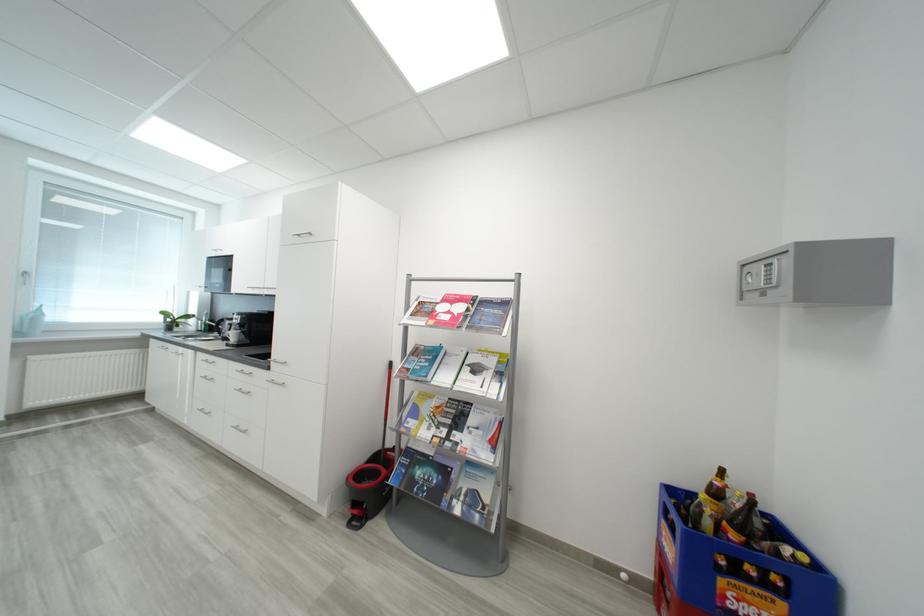
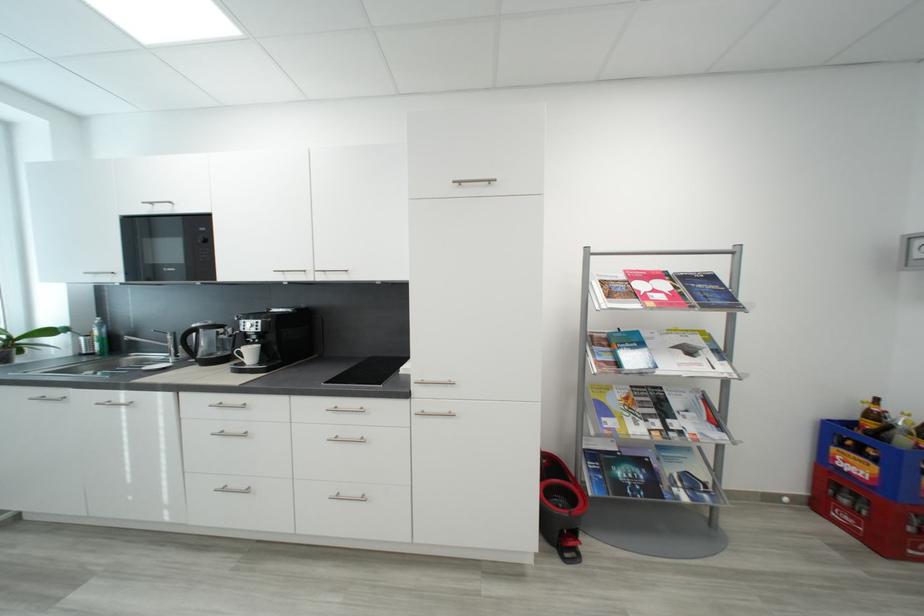
In a continuous first-person perspective shot, in which direction is the camera moving?

The movement direction of the cameraman is left, forward.